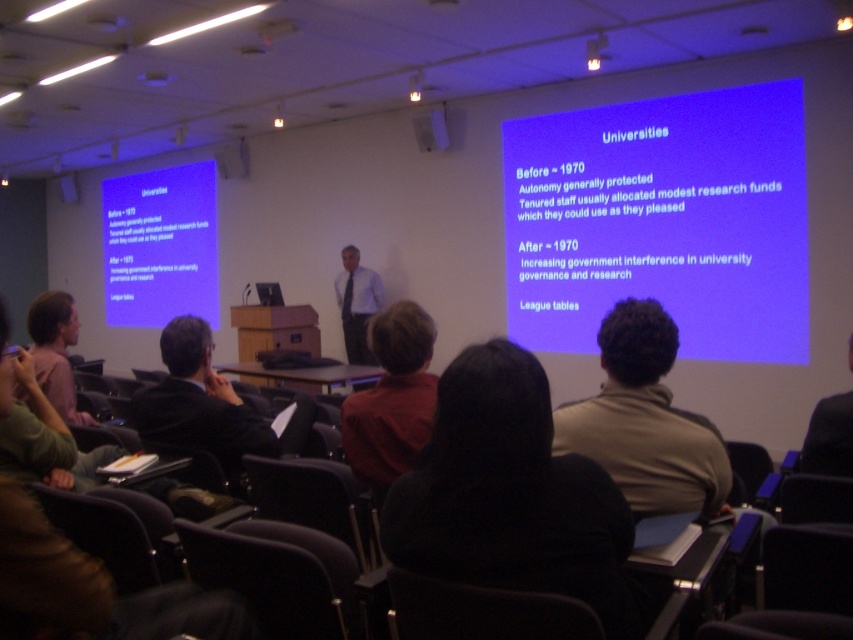
Question: Is brown fleece jacket at center to the left of red sweater at center from the viewer's perspective?

Choices:
 (A) no
 (B) yes

Answer: (A)

Question: Which point is closer to the camera?

Choices:
 (A) blue matte projection screen at upper right
 (B) light blue shirt at center

Answer: (A)

Question: Can you confirm if blue matte projection screen at upper left is bigger than black suit at center?

Choices:
 (A) yes
 (B) no

Answer: (A)

Question: Among these objects, which one is nearest to the camera?

Choices:
 (A) brown fleece jacket at center
 (B) blue matte projection screen at upper left
 (C) blue matte projection screen at upper right
 (D) red sweater at center

Answer: (A)

Question: Estimate the real-world distances between objects in this image. Which object is closer to the blue matte projection screen at upper right?

Choices:
 (A) brown fleece jacket at center
 (B) red sweater at center
 (C) blue matte projection screen at upper left

Answer: (B)

Question: Does blue matte projection screen at upper left appear over black suit at center?

Choices:
 (A) yes
 (B) no

Answer: (A)